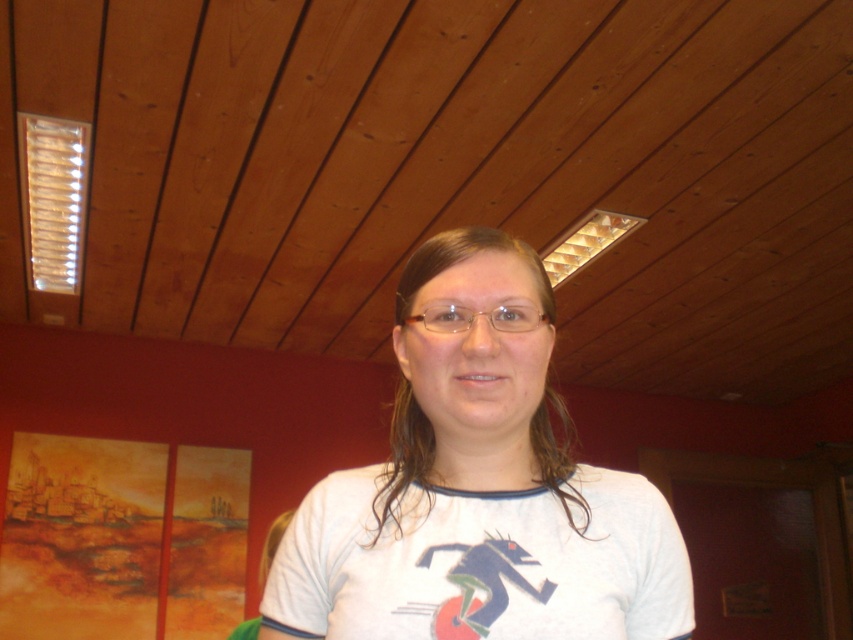
Question: From the image, what is the correct spatial relationship of white cotton t-shirt at center in relation to clear plastic glasses at center?

Choices:
 (A) below
 (B) above

Answer: (A)

Question: Which of the following is the closest to the observer?

Choices:
 (A) white cotton t-shirt at center
 (B) clear plastic glasses at center

Answer: (A)

Question: Which object appears closest to the camera in this image?

Choices:
 (A) clear plastic glasses at center
 (B) white cotton t-shirt at center

Answer: (B)

Question: Is white cotton t-shirt at center wider than clear plastic glasses at center?

Choices:
 (A) no
 (B) yes

Answer: (B)

Question: Is white cotton t-shirt at center above clear plastic glasses at center?

Choices:
 (A) yes
 (B) no

Answer: (B)